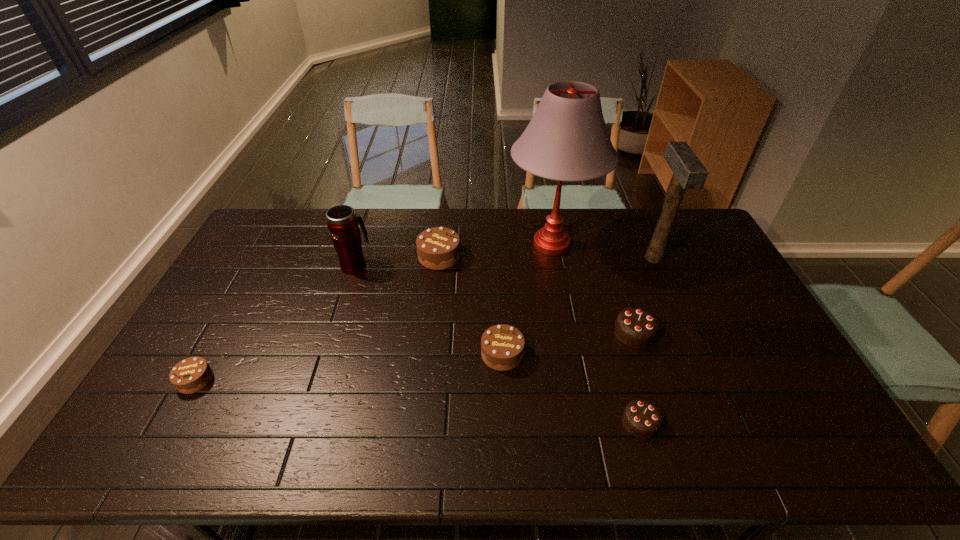
This screenshot has height=540, width=960. Find the location of `the bigger chocolate chocolate cake`. the bigger chocolate chocolate cake is located at coordinates (635, 327).

At what (x,y) coordinates should I click in order to perform the action: click on the leftmost brown chocolate cake. Please return your answer as a coordinate pair (x, y). The width and height of the screenshot is (960, 540). Looking at the image, I should click on (192, 374).

Where is `the leftmost chocolate cake`? the leftmost chocolate cake is located at coordinates (192, 374).

At what (x,y) coordinates should I click in order to perform the action: click on the nearest object. Please return your answer as a coordinate pair (x, y). The width and height of the screenshot is (960, 540). Looking at the image, I should click on (641, 418).

Where is `the smaller chocolate chocolate cake`? The height and width of the screenshot is (540, 960). the smaller chocolate chocolate cake is located at coordinates (641, 418).

Locate an element on the screen. Image resolution: width=960 pixels, height=540 pixels. vacant space located 0.100m on the front-facing side of the light table lamp is located at coordinates (479, 245).

You are a GUI agent. You are given a task and a screenshot of the screen. Output one action in this format:
    pyautogui.click(x=<x>, y=<y>)
    Task: Click on the free spot located 0.200m on the front-facing side of the light table lamp
    
    Given the screenshot: What is the action you would take?
    pyautogui.click(x=451, y=245)

In order to click on vacant space located 0.080m on the front-facing side of the light table lamp in this screenshot , I will do `click(484, 245)`.

This screenshot has width=960, height=540. I want to click on free region located 0.210m on the back of the rightmost object, so click(x=632, y=209).

Where is `free point located on the side with the handle of the second object from left to right`? This screenshot has height=540, width=960. free point located on the side with the handle of the second object from left to right is located at coordinates (370, 219).